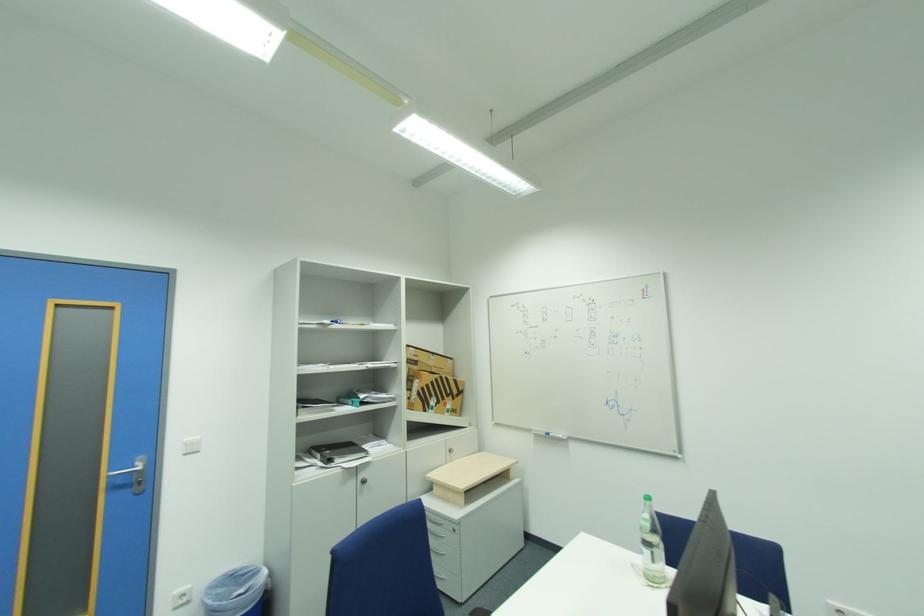
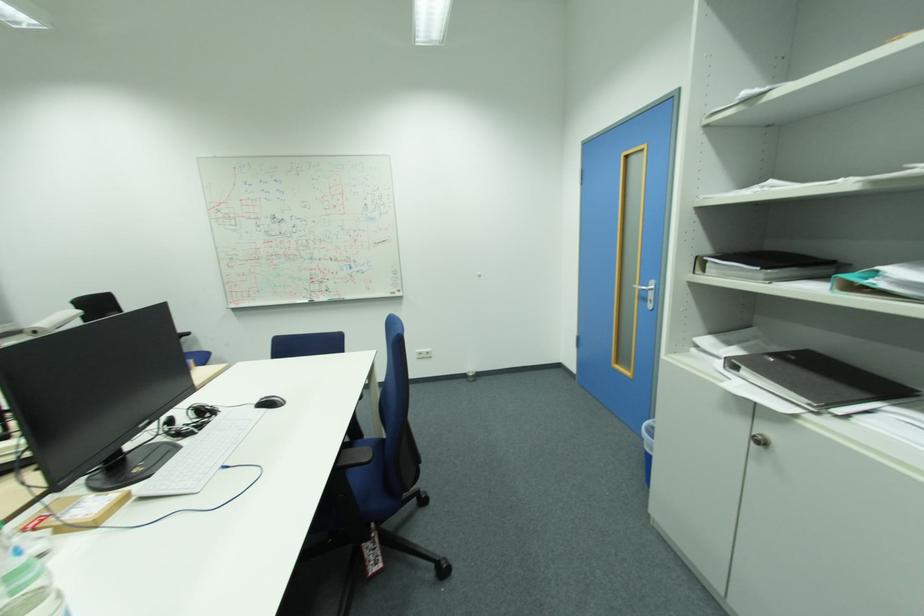
In the second image, find the point that corresponds to point 370,483 in the first image.

(766, 443)